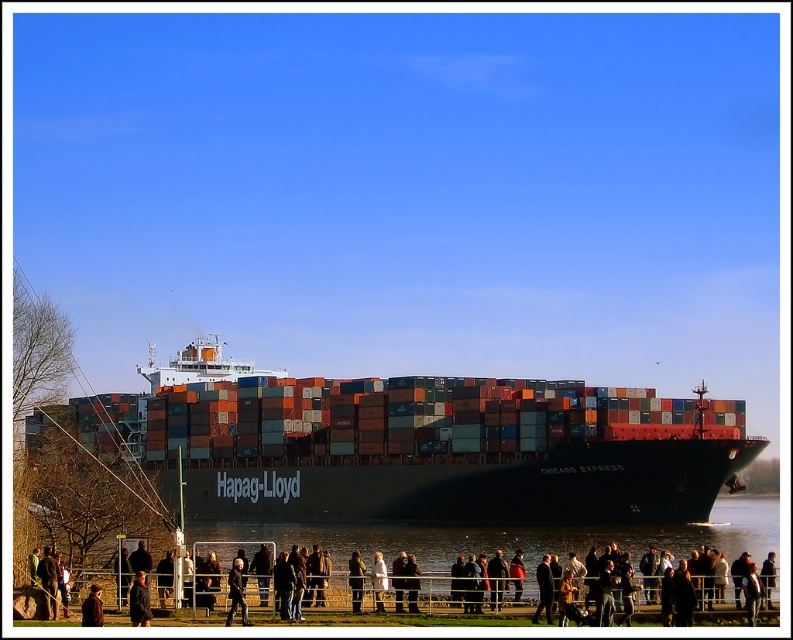
You are a photographer standing behind the metal railing. You want to take a photo of the black matte container ship at center without including the dark gray jacket at center in the frame. Is it possible to position yourself in a way that the ship is fully visible while the jacket is out of sight?

The black matte container ship at center might be wider than dark gray jacket at center, so it is possible that by moving to the side where the jacket is not obstructing the view, you can capture the entire ship while excluding the jacket from the frame.

You are standing on a pier and see the black matte container ship at center and the dark gray jacket at center. Which object is closer to you?

The dark gray jacket at center is closer to you because the black matte container ship at center is positioned over it.